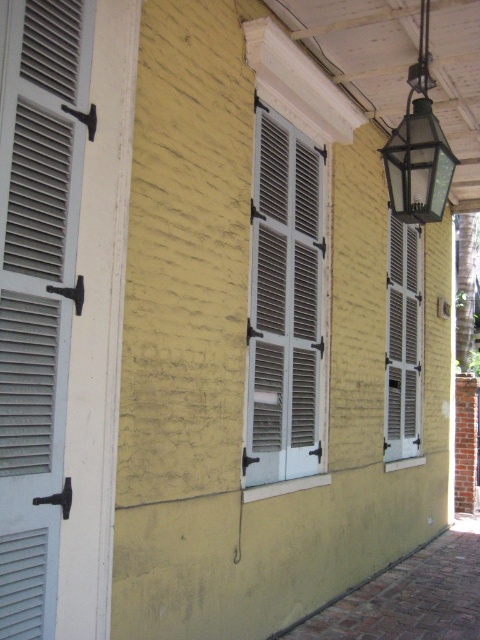
Question: Can you confirm if white matte shutters at left is positioned to the left of white matte shutters at center?

Choices:
 (A) no
 (B) yes

Answer: (B)

Question: Can you confirm if white matte shutters at center is positioned above white matte shutter at center?

Choices:
 (A) yes
 (B) no

Answer: (A)

Question: Which point appears closest to the camera in this image?

Choices:
 (A) (398, 212)
 (B) (275, 436)
 (C) (63, 429)
 (D) (418, 300)

Answer: (C)

Question: Estimate the real-world distances between objects in this image. Which object is farther from the white matte shutters at left?

Choices:
 (A) white matte shutters at center
 (B) white matte shutter at center

Answer: (B)

Question: Does white matte shutter at center appear over clear glass lantern at upper right?

Choices:
 (A) yes
 (B) no

Answer: (B)

Question: Which object appears closest to the camera in this image?

Choices:
 (A) white matte shutters at center
 (B) white matte shutters at left
 (C) white matte shutter at center
 (D) clear glass lantern at upper right

Answer: (B)